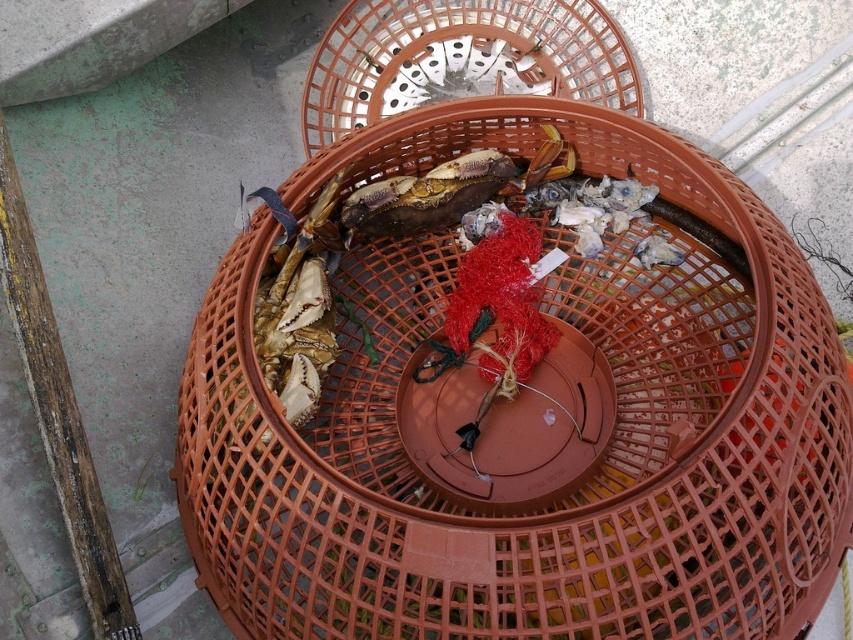
Question: Is translucent plastic basket at center positioned behind shiny brown crab at center?

Choices:
 (A) yes
 (B) no

Answer: (A)

Question: Where is translucent plastic basket at center located in relation to shiny brown crab at center in the image?

Choices:
 (A) right
 (B) left

Answer: (A)

Question: Among these points, which one is farthest from the camera?

Choices:
 (A) (369, 100)
 (B) (476, 193)

Answer: (A)

Question: Which of these objects is positioned closest to the translucent plastic basket at center?

Choices:
 (A) brown plastic basket at center
 (B) shiny brown crab at center

Answer: (B)

Question: Does brown plastic basket at center appear over shiny brown crab at center?

Choices:
 (A) yes
 (B) no

Answer: (B)

Question: Which of the following is the closest to the observer?

Choices:
 (A) shiny brown crab at center
 (B) translucent plastic basket at center

Answer: (A)